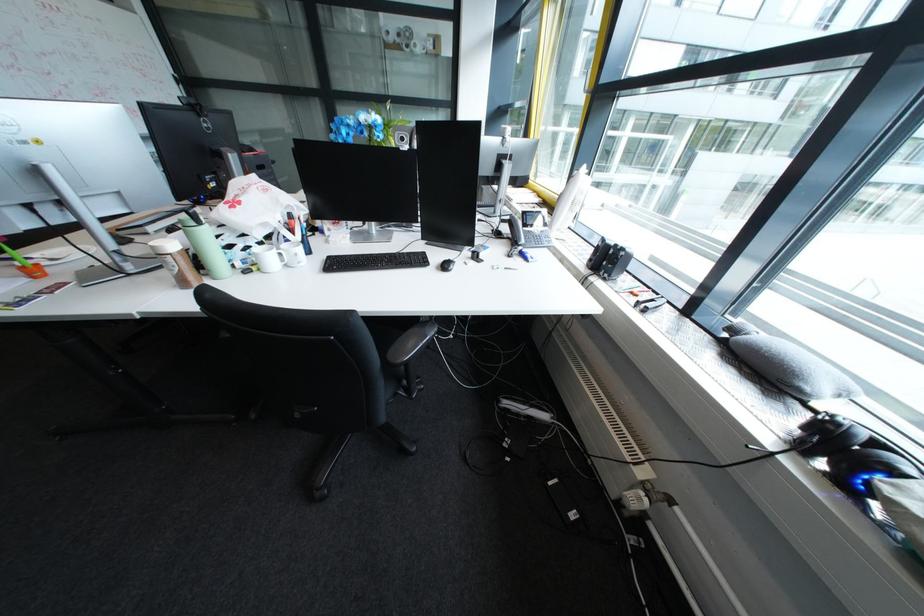
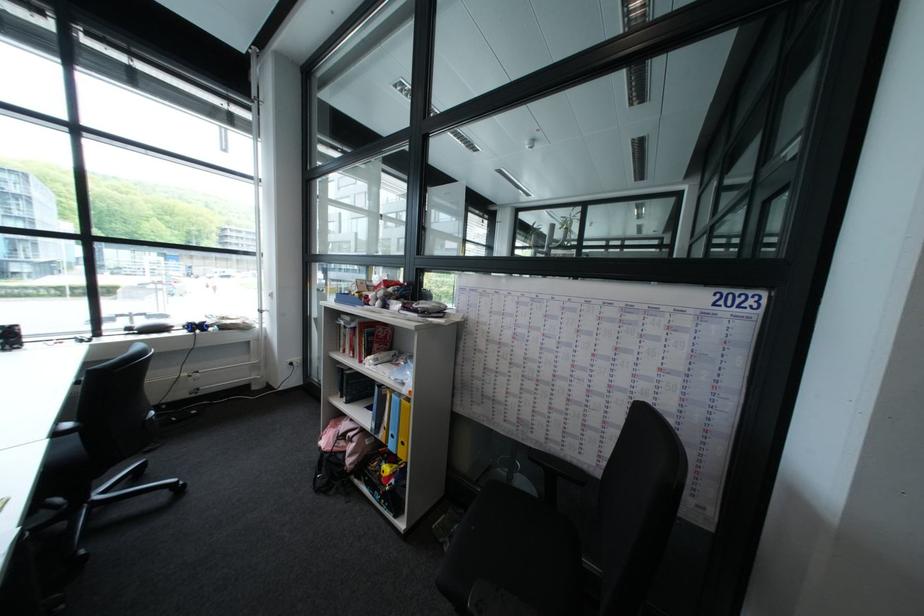
Find the pixel in the second image that matches [854,419] in the first image.

(203, 322)